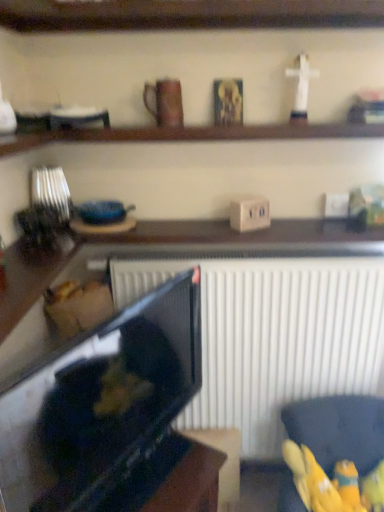
Question: Considering the positions of point (206, 126) and point (299, 102), is point (206, 126) closer or farther from the camera than point (299, 102)?

Choices:
 (A) farther
 (B) closer

Answer: (A)

Question: Is wooden shelf at upper center, the 2th shelf when ordered from top to bottom, taller or shorter than white plastic cross at upper right, which is the 4th toy in bottom-to-top order?

Choices:
 (A) short
 (B) tall

Answer: (A)

Question: Which of these objects is positioned farthest from the glossy black tv at lower left?

Choices:
 (A) yellow fabric bag at lower right
 (B) brown matte mug at upper center
 (C) yellow fabric toy at lower right, the 4th toy in the top-to-bottom sequence
 (D) white plastic cross at upper right, which is counted as the first toy, starting from the left
 (E) wooden shelf at upper center, which is counted as the first shelf, starting from the top

Answer: (E)

Question: Based on their relative distances, which object is farther from the yellow fabric bag at lower right?

Choices:
 (A) black glossy tv at center
 (B) wooden figurine at upper right, the second toy positioned from the top
 (C) wooden shelf at upper center, the 2th shelf when ordered from top to bottom
 (D) white plastic cross at upper right, which is counted as the first toy, starting from the left
 (E) yellow fabric toy at lower right, the second toy in the left-to-right sequence

Answer: (D)